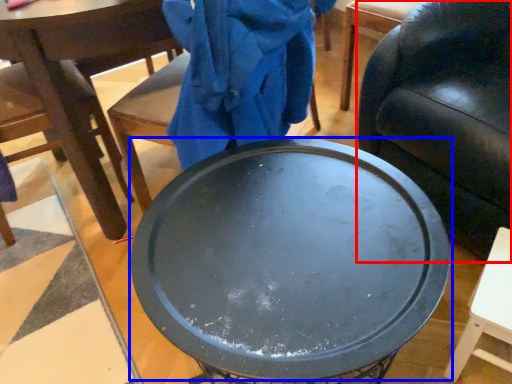
Question: Which point is closer to the camera, chair (highlighted by a red box) or round table (highlighted by a blue box)?

Choices:
 (A) chair
 (B) round table

Answer: (B)